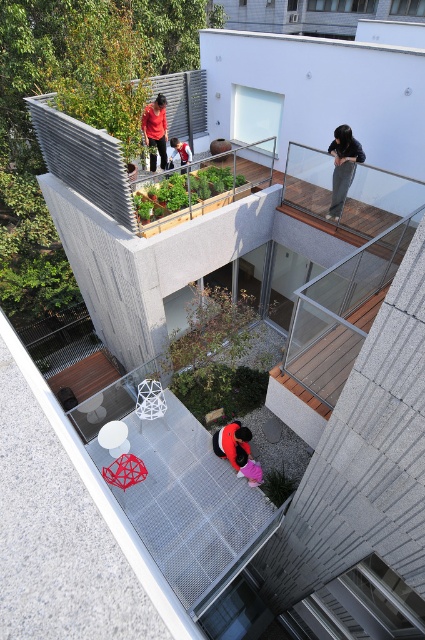
Question: Which point appears farthest from the camera in this image?

Choices:
 (A) (257, 468)
 (B) (243, 436)
 (C) (354, 164)
 (D) (189, 157)

Answer: (D)

Question: Does dark gray pants at upper right have a smaller size compared to matte black jacket at upper center?

Choices:
 (A) no
 (B) yes

Answer: (B)

Question: Which point appears closest to the camera in this image?

Choices:
 (A) (119, 316)
 (B) (238, 460)
 (C) (342, 204)

Answer: (B)

Question: Estimate the real-world distances between objects in this image. Which object is closer to the matte red shirt at upper center?

Choices:
 (A) matte black jacket at center
 (B) matte black jacket at upper center
 (C) wooden deck at upper center

Answer: (B)

Question: From the image, what is the correct spatial relationship of dark gray pants at upper right in relation to matte red shirt at upper center?

Choices:
 (A) below
 (B) above

Answer: (A)

Question: Is matte pink dress at lower center smaller than matte black jacket at upper center?

Choices:
 (A) yes
 (B) no

Answer: (A)